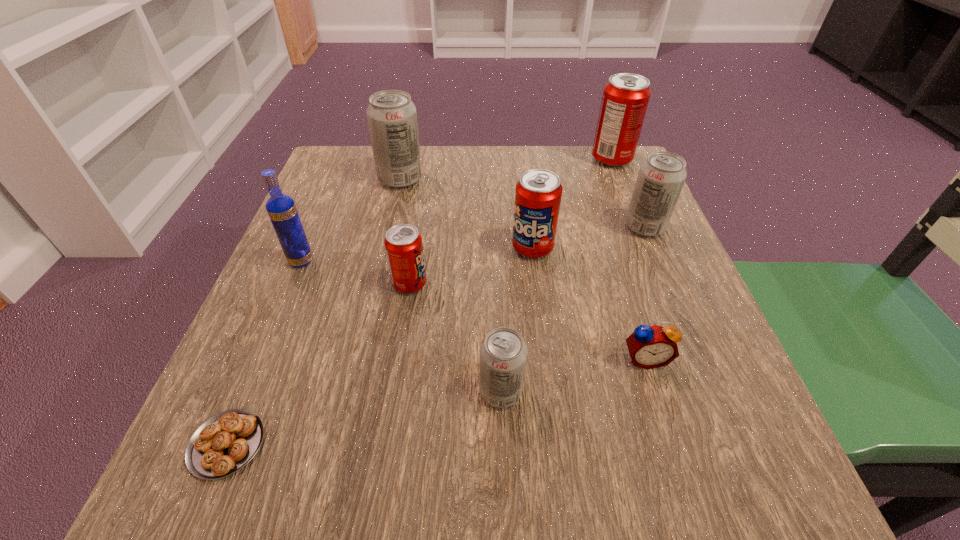
This screenshot has width=960, height=540. Identify the location of the nearest red soda can. (403, 243).

At what (x,y) coordinates should I click in order to perform the action: click on the second gray soda can from right to left. Please return your answer as a coordinate pair (x, y). The image size is (960, 540). Looking at the image, I should click on (503, 353).

At what (x,y) coordinates should I click in order to perform the action: click on the nearest gray soda can. Please return your answer as a coordinate pair (x, y). Looking at the image, I should click on (503, 353).

Where is `red alarm clock`? This screenshot has width=960, height=540. red alarm clock is located at coordinates (654, 346).

Identify the location of alarm clock. point(654,346).

Where is `pastry`? Image resolution: width=960 pixels, height=540 pixels. pastry is located at coordinates (225, 443).

This screenshot has width=960, height=540. I want to click on free space located 0.160m on the front of the rightmost red soda can, so click(633, 210).

The height and width of the screenshot is (540, 960). I want to click on vacant region located on the right of the biggest gray soda can, so click(516, 179).

At what (x,y) coordinates should I click in order to perform the action: click on vacant region located 0.100m on the back of the vodka. Please return your answer as a coordinate pair (x, y). Image resolution: width=960 pixels, height=540 pixels. Looking at the image, I should click on (318, 221).

Find the location of a particular element. vacant space situated 0.250m on the front of the second nearest gray soda can is located at coordinates [x=693, y=341].